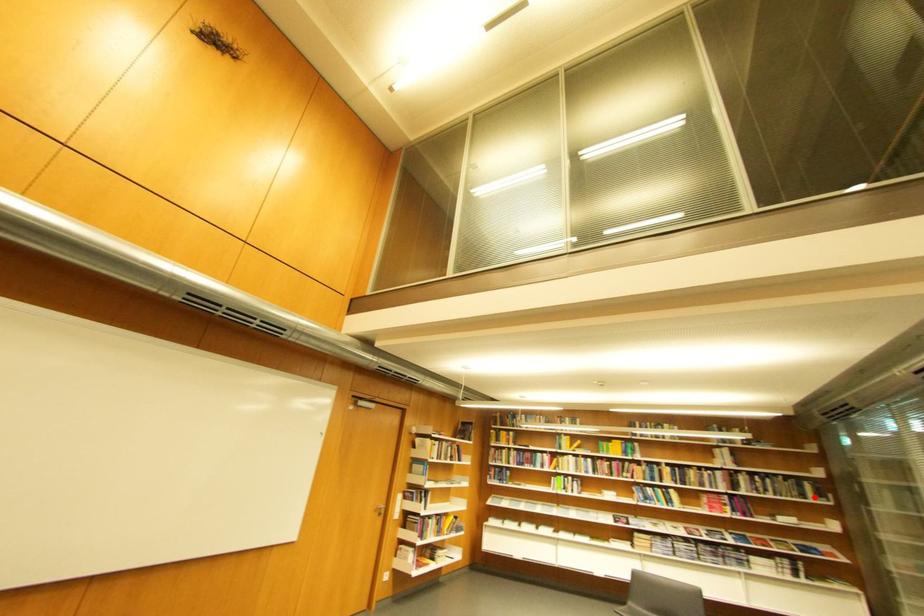
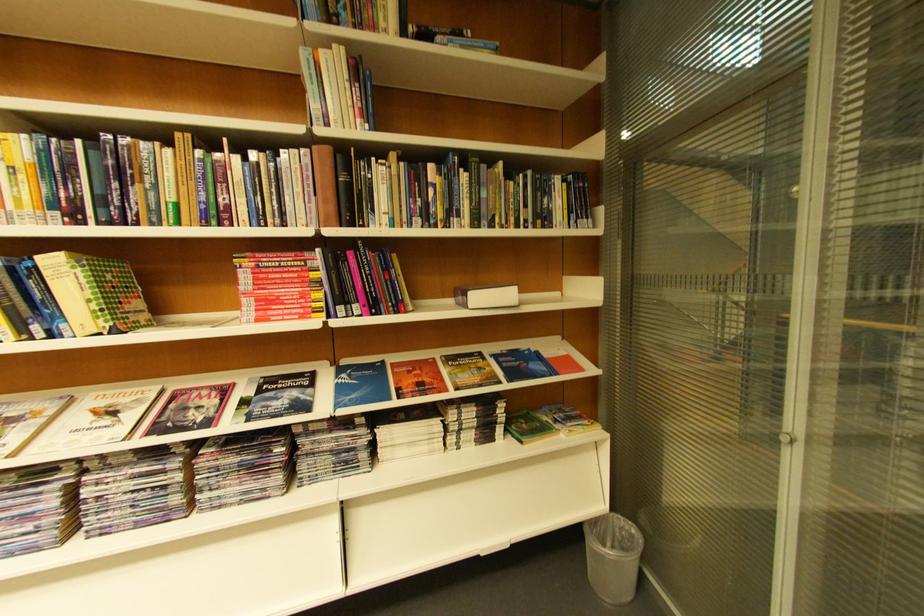
Locate, in the second image, the point that corresponds to the highlighted location in the first image.

(554, 221)